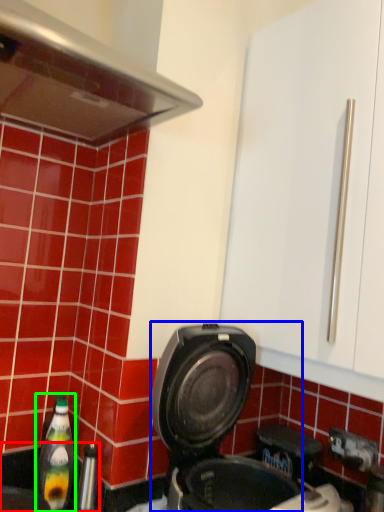
Question: Which object is the farthest from sink (highlighted by a red box)? Choose among these: kitchen appliance (highlighted by a blue box) or bottle (highlighted by a green box).

Choices:
 (A) kitchen appliance
 (B) bottle

Answer: (A)